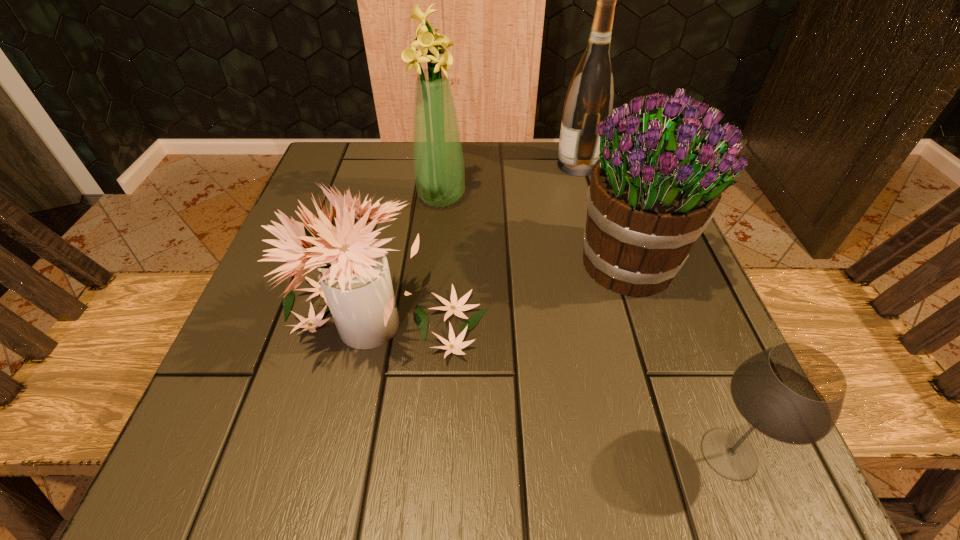
Where is `free space between the rightmost bouquet and the shortest bouquet`? This screenshot has width=960, height=540. free space between the rightmost bouquet and the shortest bouquet is located at coordinates (506, 293).

The height and width of the screenshot is (540, 960). In order to click on empty location between the rightmost bouquet and the second farthest object in this screenshot , I will do click(536, 231).

At what (x,y) coordinates should I click in order to perform the action: click on free space between the third shortest object and the fourth tallest object. Please return your answer as a coordinate pair (x, y). Looking at the image, I should click on [506, 293].

I want to click on vacant space that's between the wine bottle and the shortest object, so click(x=654, y=309).

Locate an element on the screen. This screenshot has width=960, height=540. unoccupied area between the second shortest object and the nearest object is located at coordinates (555, 387).

In order to click on free area in between the second shortest bouquet and the nearest object in this screenshot , I will do `click(680, 359)`.

Identify the location of unoccupied position between the wine bottle and the farthest bouquet. This screenshot has width=960, height=540. 510,181.

The image size is (960, 540). What are the coordinates of `free space between the tallest bouquet and the third shortest object` in the screenshot? It's located at (536, 231).

Locate an element on the screen. This screenshot has width=960, height=540. object that is the fourth nearest to the wine bottle is located at coordinates (793, 393).

At what (x,y) coordinates should I click in order to perform the action: click on object that can be found as the closest to the second shortest object. Please return your answer as a coordinate pair (x, y). The width and height of the screenshot is (960, 540). Looking at the image, I should click on (653, 191).